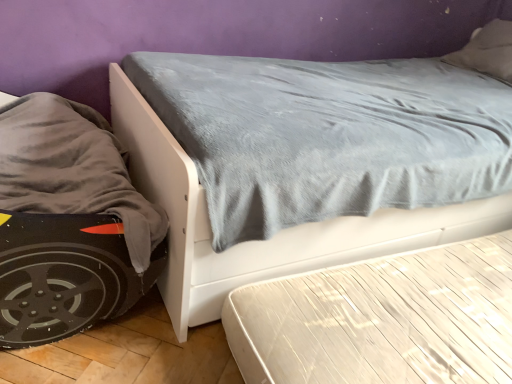
Question: Is white glossy mattress at lower right in front of or behind velvet gray bed at center in the image?

Choices:
 (A) behind
 (B) front

Answer: (A)

Question: From the image's perspective, is white glossy mattress at lower right positioned above or below velvet gray bed at center?

Choices:
 (A) above
 (B) below

Answer: (B)

Question: Is white glossy mattress at lower right bigger or smaller than velvet gray bed at center?

Choices:
 (A) small
 (B) big

Answer: (A)

Question: Looking at the image, does velvet gray bed at center seem bigger or smaller compared to white glossy mattress at lower right?

Choices:
 (A) small
 (B) big

Answer: (B)

Question: Does point (181, 258) appear closer or farther from the camera than point (464, 334)?

Choices:
 (A) closer
 (B) farther

Answer: (A)

Question: Is velvet gray bed at center in front of or behind white glossy mattress at lower right in the image?

Choices:
 (A) front
 (B) behind

Answer: (A)

Question: From a real-world perspective, relative to white glossy mattress at lower right, is velvet gray bed at center vertically above or below?

Choices:
 (A) above
 (B) below

Answer: (A)